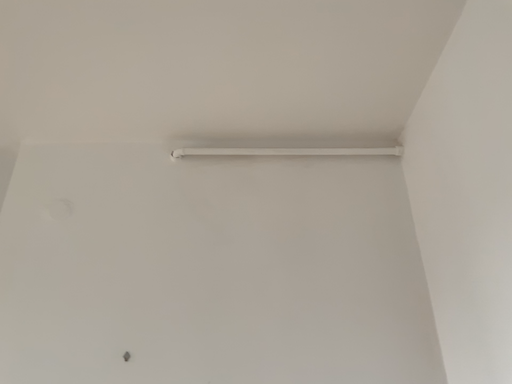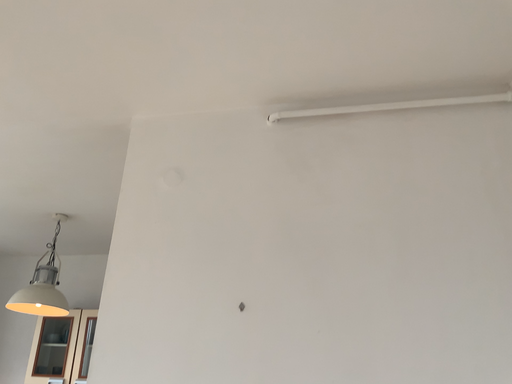
Question: How did the camera likely rotate when shooting the video?

Choices:
 (A) rotated right
 (B) rotated left

Answer: (B)